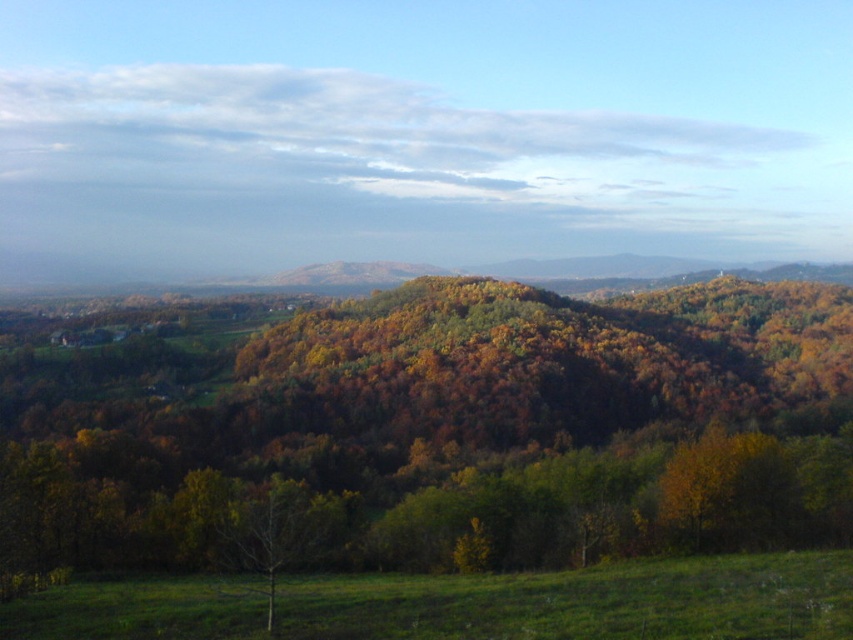
Question: Which point is closer to the camera?

Choices:
 (A) bare branch at center
 (B) autumn leaves at center

Answer: (A)

Question: In this image, where is autumn leaves at center located relative to bare branch at center?

Choices:
 (A) above
 (B) below

Answer: (B)

Question: Where is autumn leaves at center located in relation to bare branch at center in the image?

Choices:
 (A) left
 (B) right

Answer: (A)

Question: Does autumn leaves at center appear on the right side of bare branch at center?

Choices:
 (A) no
 (B) yes

Answer: (A)